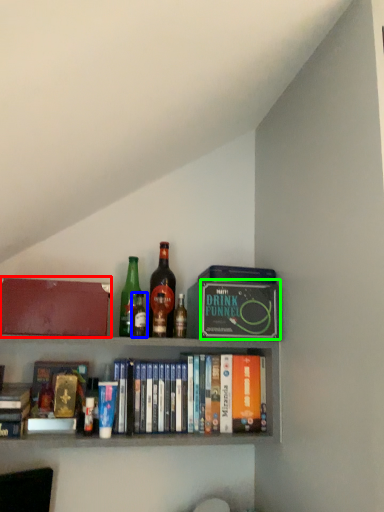
Question: Which object is the closest to the box (highlighted by a red box)? Choose among these: bottle (highlighted by a blue box) or paperback book (highlighted by a green box).

Choices:
 (A) bottle
 (B) paperback book

Answer: (A)